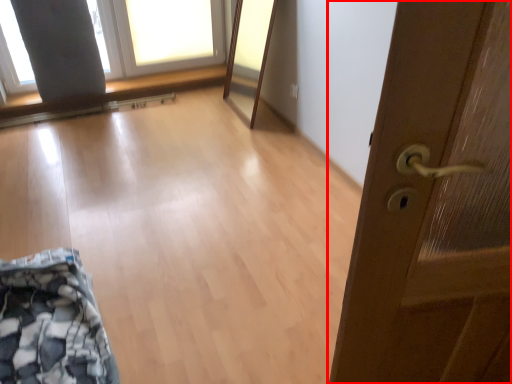
Question: From the image's perspective, where is door (annotated by the red box) located in relation to window screen in the image?

Choices:
 (A) above
 (B) below

Answer: (B)